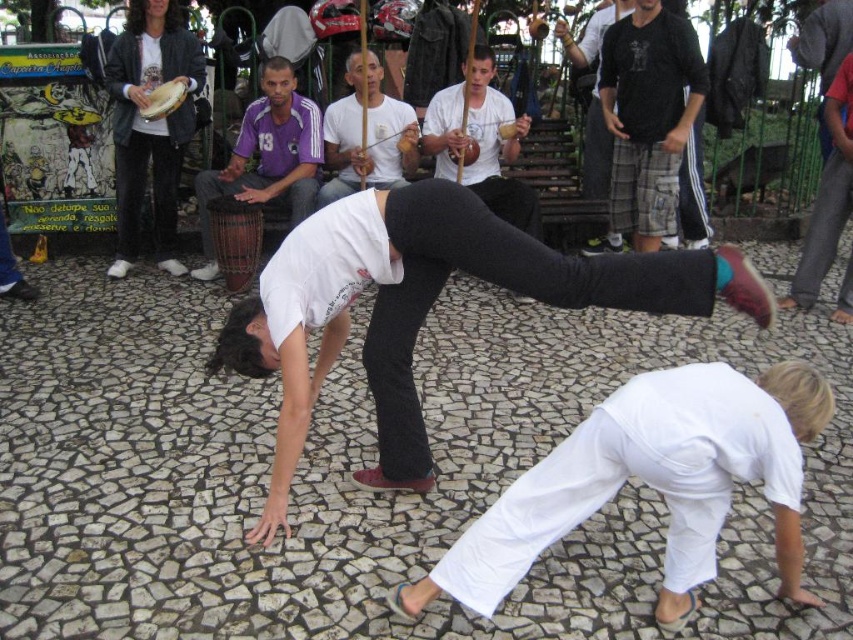
Does black cotton shirt at upper center come behind dark gray plaid shorts at upper right?

No.

Can you confirm if black cotton shirt at upper center is thinner than dark gray plaid shorts at upper right?

No, black cotton shirt at upper center is not thinner than dark gray plaid shorts at upper right.

Image resolution: width=853 pixels, height=640 pixels. What do you see at coordinates (648, 115) in the screenshot?
I see `black cotton shirt at upper center` at bounding box center [648, 115].

Where is `black cotton shirt at upper center`? The image size is (853, 640). black cotton shirt at upper center is located at coordinates (648, 115).

Is point (154, 234) closer to camera compared to point (369, 83)?

No, (154, 234) is further to viewer.

Can you confirm if matte black drum at left is wider than white cotton shirt at center?

Yes, matte black drum at left is wider than white cotton shirt at center.

Locate an element on the screen. The height and width of the screenshot is (640, 853). matte black drum at left is located at coordinates (149, 124).

From the picture: Is the position of purple jersey at center less distant than that of dark gray plaid shorts at upper right?

Yes, purple jersey at center is closer to the viewer.

Is purple jersey at center smaller than dark gray plaid shorts at upper right?

No.

Which is in front, point (215, 257) or point (585, 32)?

Point (215, 257) is in front.

Locate an element on the screen. The width and height of the screenshot is (853, 640). purple jersey at center is located at coordinates (267, 156).